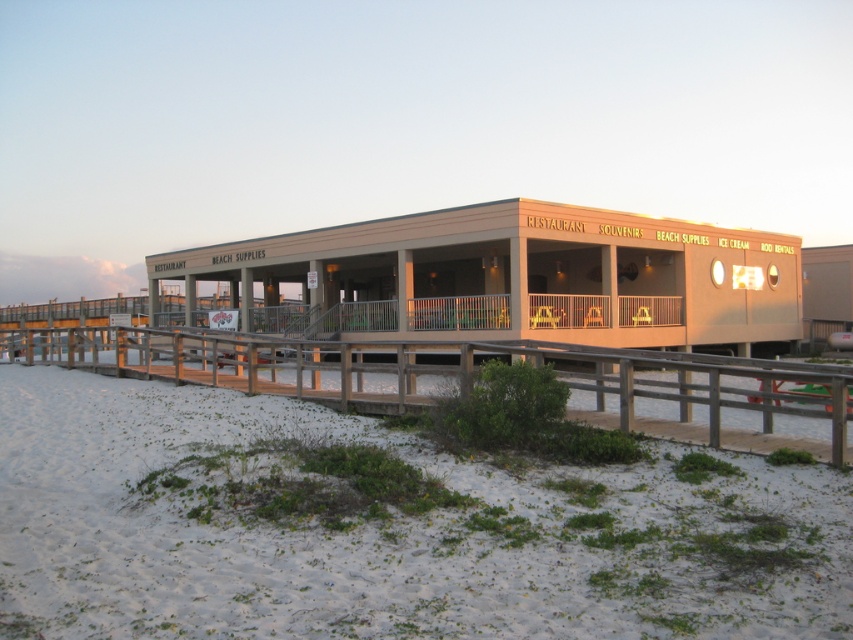
In the scene shown: You are a tourist standing on the beige wooden dock at center and want to walk to the wooden at lower left. Which direction should you head?

You should head to the right because the beige wooden dock at center is to the left of the wooden at lower left, so moving right will take you towards it.